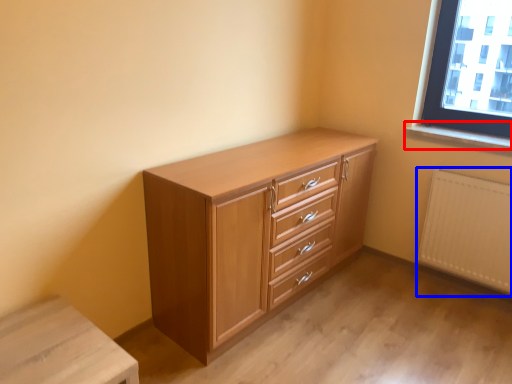
Question: Which object is closer to the camera taking this photo, window sill (highlighted by a red box) or radiator (highlighted by a blue box)?

Choices:
 (A) window sill
 (B) radiator

Answer: (B)